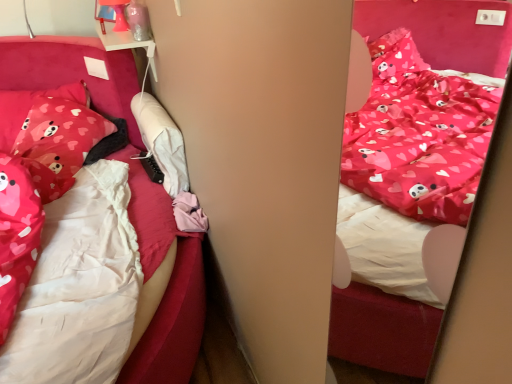
Question: From the image's perspective, relative to matte pink fabric bed at center, is matte pink pillow with heart patterns at left, the 2th pillow viewed from the right, above or below?

Choices:
 (A) above
 (B) below

Answer: (A)

Question: Looking at their shapes, would you say matte pink pillow with heart patterns at left, the 1th pillow positioned from the left, is wider or thinner than matte pink fabric bed at center?

Choices:
 (A) wide
 (B) thin

Answer: (A)

Question: Which of these objects is positioned farthest from the matte pink pillow with heart patterns at left, the 2th pillow viewed from the right?

Choices:
 (A) matte pink fabric bed at center
 (B) matte pink pillow with heart patterns at left, arranged as the first pillow when viewed from the right

Answer: (A)

Question: Considering the real-world distances, which object is closest to the matte pink pillow with heart patterns at left, arranged as the first pillow when viewed from the right?

Choices:
 (A) matte pink fabric bed at center
 (B) matte pink pillow with heart patterns at left, the 2th pillow viewed from the right

Answer: (B)